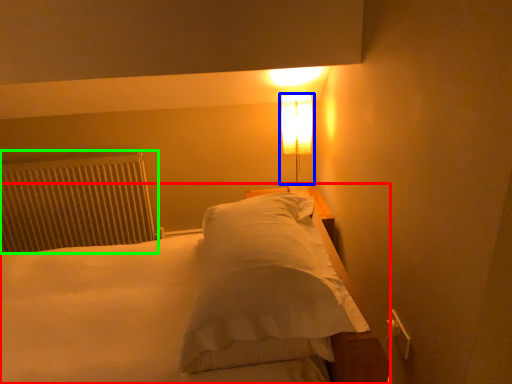
Question: Which is nearer to the bed (highlighted by a red box)? lamp (highlighted by a blue box) or radiator (highlighted by a green box).

Choices:
 (A) lamp
 (B) radiator

Answer: (B)